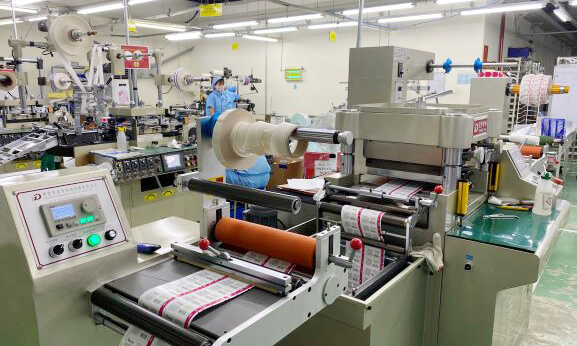
This screenshot has width=577, height=346. In order to click on red cloth in this screenshot , I will do `click(261, 239)`.